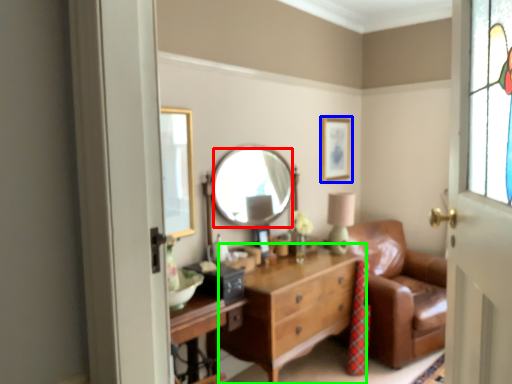
Question: Which object is positioned closest to mirror (highlighted by a red box)? Select from picture frame (highlighted by a blue box) and chest of drawers (highlighted by a green box).

Choices:
 (A) picture frame
 (B) chest of drawers

Answer: (B)